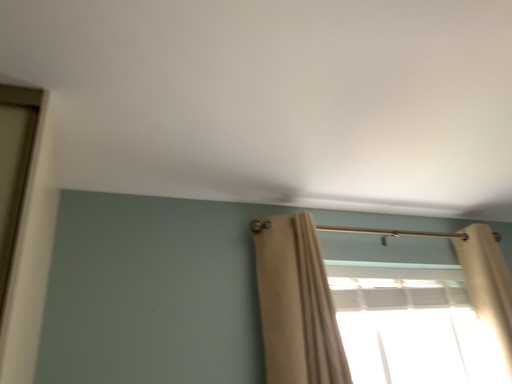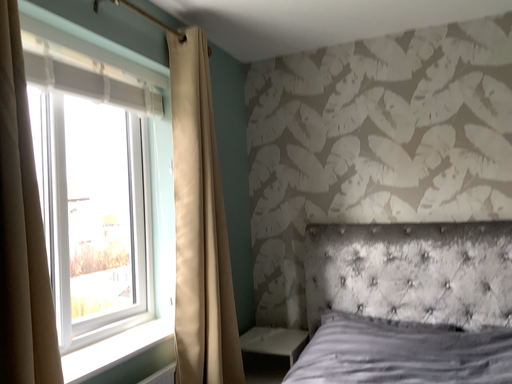
Question: Which way did the camera rotate in the video?

Choices:
 (A) rotated upward
 (B) rotated downward

Answer: (B)